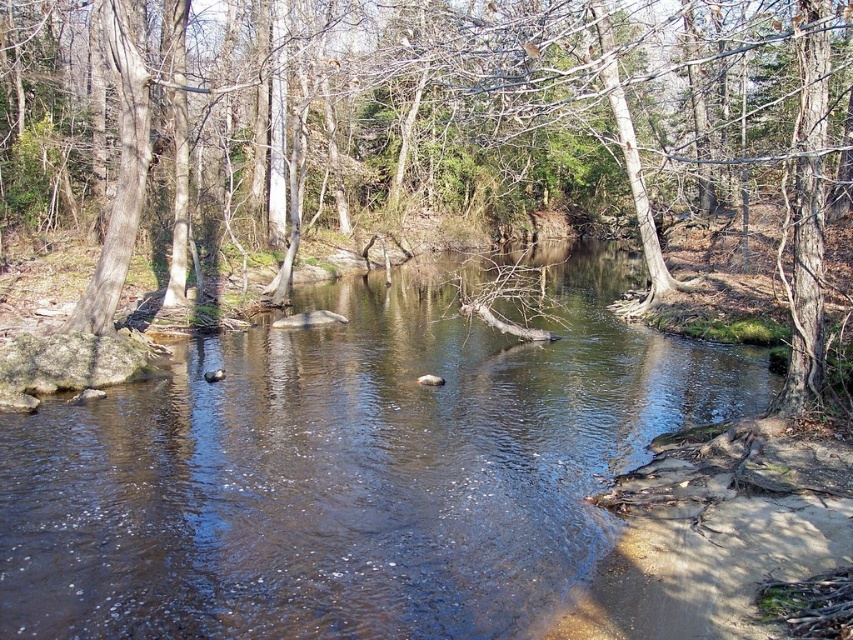
Question: Among these points, which one is farthest from the camera?

Choices:
 (A) (450, 8)
 (B) (71, 490)

Answer: (A)

Question: Can you confirm if brown smooth river at center is positioned to the right of brown bark tree at center?

Choices:
 (A) yes
 (B) no

Answer: (B)

Question: Does brown smooth river at center lie in front of brown bark tree at center?

Choices:
 (A) yes
 (B) no

Answer: (B)

Question: Can you confirm if brown smooth river at center is bigger than brown bark tree at center?

Choices:
 (A) yes
 (B) no

Answer: (B)